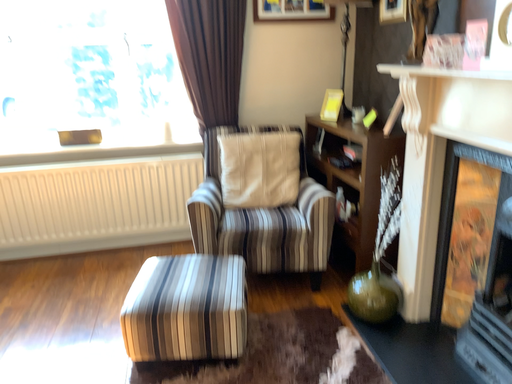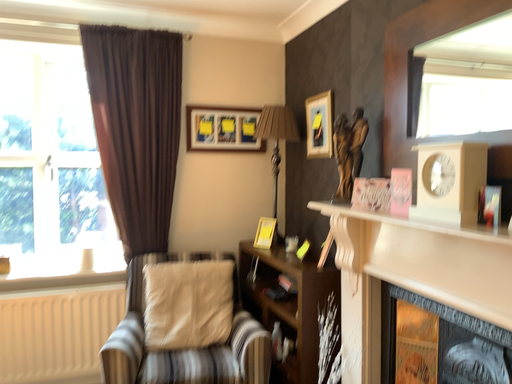
Question: How did the camera likely rotate when shooting the video?

Choices:
 (A) rotated upward
 (B) rotated downward

Answer: (A)